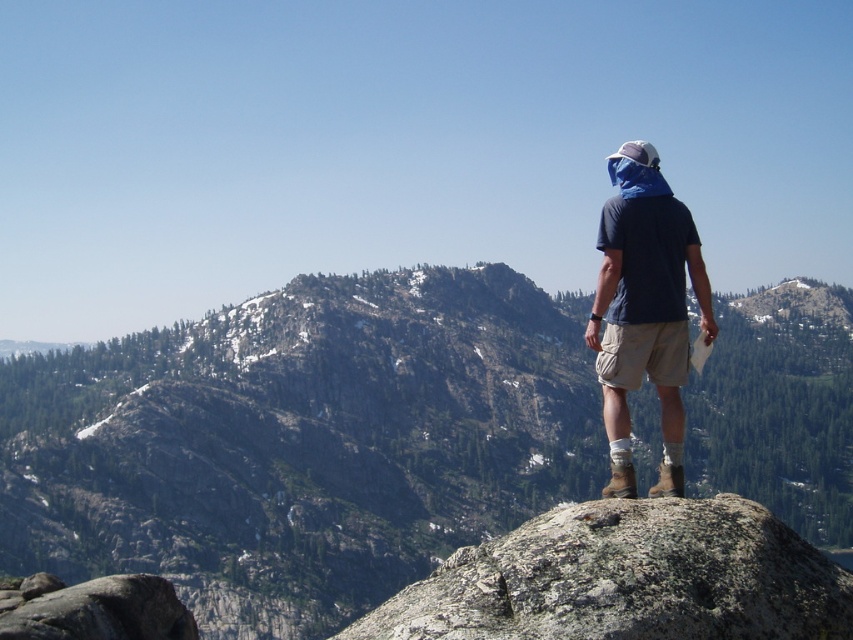
Does gray rough rock at center appear on the right side of gray rock at lower left?

Indeed, gray rough rock at center is positioned on the right side of gray rock at lower left.

Is point (520, 525) farther from viewer compared to point (119, 605)?

Yes, it is behind point (119, 605).

Is point (758, 616) positioned behind point (143, 636)?

No, (758, 616) is closer to viewer.

Find the location of `gray rough rock at center`. gray rough rock at center is located at coordinates (627, 579).

Who is taller, blue fabric hat at upper right or gray rock at lower left?

Standing taller between the two is blue fabric hat at upper right.

Identify the location of blue fabric hat at upper right. click(643, 308).

Is point (605, 368) positioned in front of point (61, 621)?

Yes, point (605, 368) is in front of point (61, 621).

The height and width of the screenshot is (640, 853). I want to click on blue fabric hat at upper right, so click(x=643, y=308).

Does green textured rock at center have a greater height compared to blue fabric hat at upper right?

Yes, green textured rock at center is taller than blue fabric hat at upper right.

Image resolution: width=853 pixels, height=640 pixels. What are the coordinates of `green textured rock at center` in the screenshot? It's located at (300, 442).